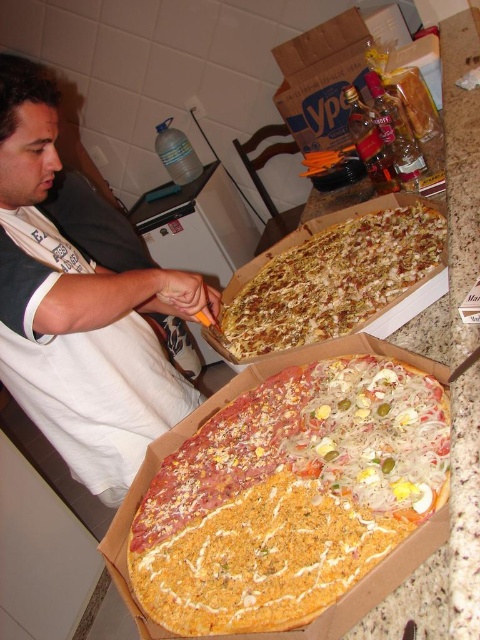
Does cheesy crust pizza at center appear under crusty golden-brown pizza at center?

Yes.

Is cheesy crust pizza at center to the left of crusty golden-brown pizza at center from the viewer's perspective?

Correct, you'll find cheesy crust pizza at center to the left of crusty golden-brown pizza at center.

Is point (207, 625) more distant than point (356, 224)?

No, it is not.

This screenshot has width=480, height=640. I want to click on cheesy crust pizza at center, so click(288, 497).

Is point (177, 307) closer to viewer compared to point (379, 316)?

No, it is behind (379, 316).

Is white cotton shirt at left taller than crusty golden-brown pizza at center?

Indeed, white cotton shirt at left has a greater height compared to crusty golden-brown pizza at center.

Which is in front, point (194, 305) or point (241, 330)?

Positioned in front is point (194, 305).

I want to click on white cotton shirt at left, so click(79, 310).

Is cheesy crust pizza at center wider than white cotton shirt at left?

Yes.

Which is below, cheesy crust pizza at center or white cotton shirt at left?

Positioned lower is cheesy crust pizza at center.

Which is in front, point (381, 476) or point (167, 278)?

Positioned in front is point (381, 476).

Identify the location of cheesy crust pizza at center. The height and width of the screenshot is (640, 480). (288, 497).